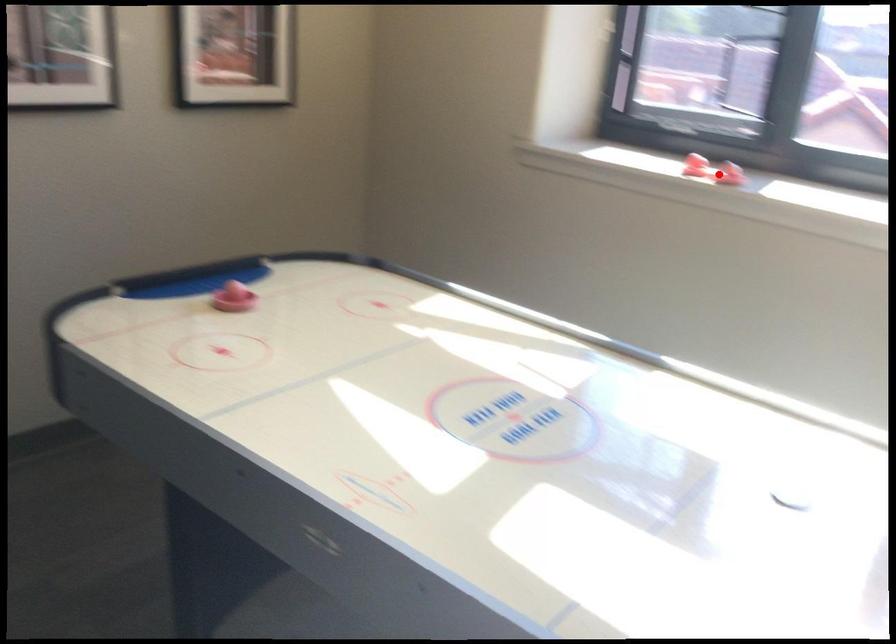
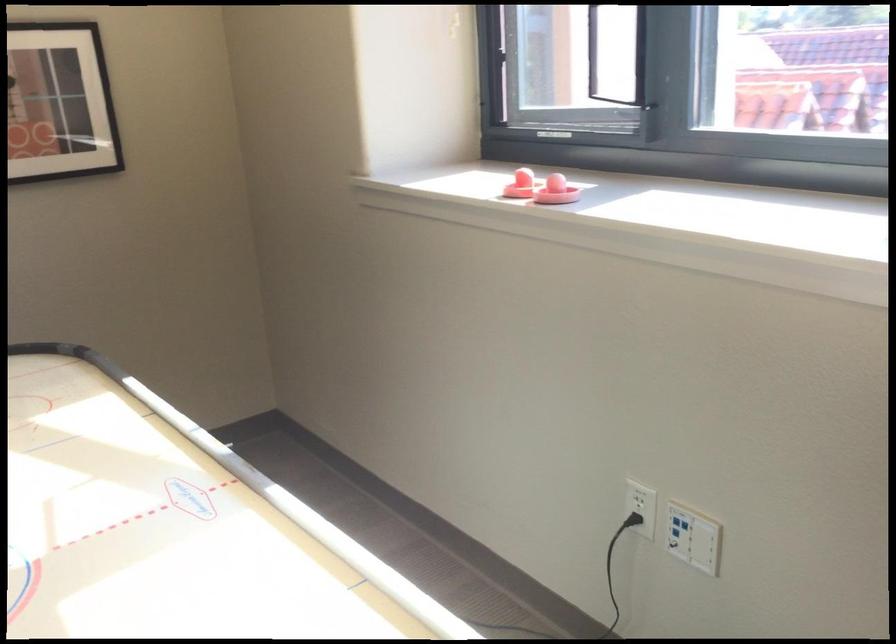
In the second image, find the point that corresponds to the highlighted location in the first image.

(556, 191)